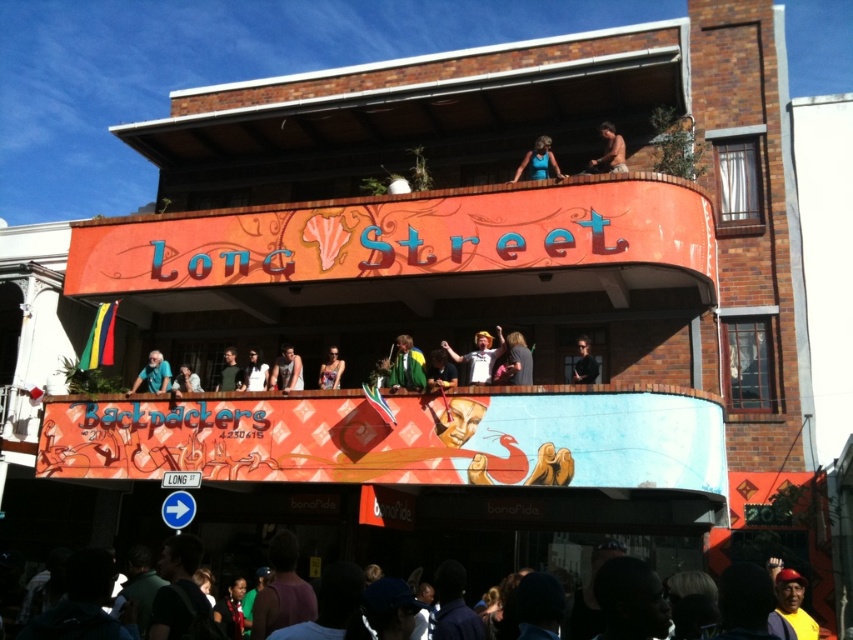
You are a guest at the Long Street Backpackers hostel in Cape Town. You notice two items on the balcony where people are gathered. One is the green jersey at center and the other is the blue fabric shirt at upper center. Which one is positioned higher up?

The blue fabric shirt at upper center is positioned higher up than the green jersey at center.

You are a photographer at the hostel and want to capture the group on the balcony. Since you want to highlight the people, which object should you focus on more, the bare skin at upper center or the matte black shirt at upper center?

The bare skin at upper center has a larger size compared to the matte black shirt at upper center, so you should focus on the bare skin at upper center to highlight the people.

Looking at this image, you are a photographer planning to take a group photo of the green jersey at center and the blue fabric shirt at upper center. Which of the two clothing items will appear bigger in the photo?

The green jersey at center will appear bigger in the photo because it has a larger size compared to the blue fabric shirt at upper center.